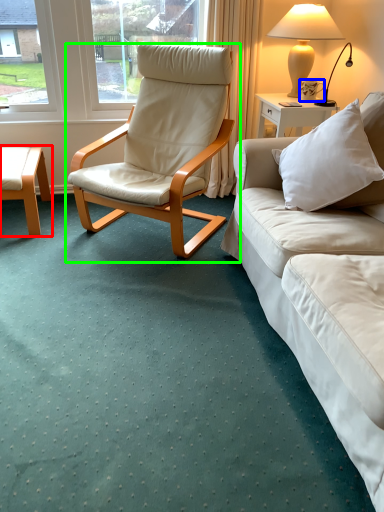
Question: Based on their relative distances, which object is nearer to coffee table (highlighted by a red box)? Choose from coffee cup (highlighted by a blue box) and chair (highlighted by a green box).

Choices:
 (A) coffee cup
 (B) chair

Answer: (B)